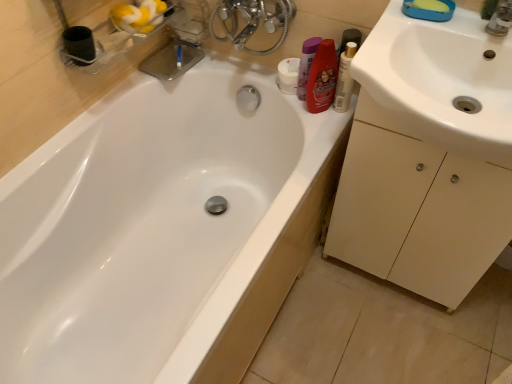
This screenshot has height=384, width=512. In order to click on vacant space to the right of yellow sponge at upper right in this screenshot , I will do `click(475, 19)`.